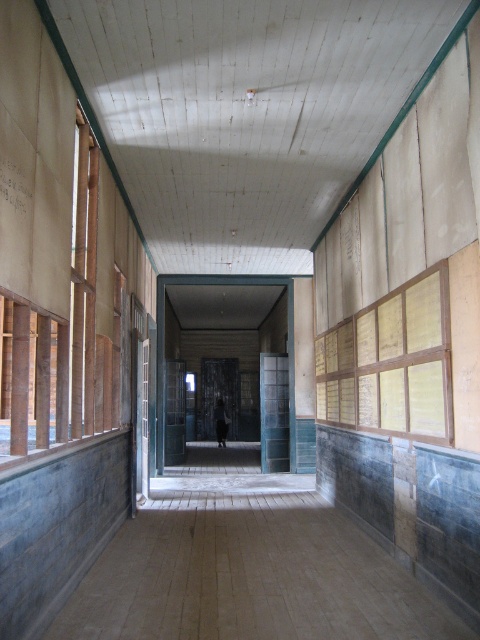
You are standing at the entrance of the corridor and want to place a new poster. You have two options for placement based on the existing items. The wooden paneling at right and the white paper at upper left are already present. Which object is located to the right side of the corridor?

The wooden paneling at right is located to the right side of the corridor, as it is positioned to the right of the white paper at upper left.

You are standing in the corridor and want to move from point A to point B. Point A is at coordinates point (x=20, y=205) and point B is at coordinates point (x=360, y=381). Given the corridor is narrow, will you have to navigate around any obstacles between these two points?

Since point (x=360, y=381) is behind point (x=20, y=205), you can move directly from point A to point B without needing to navigate around obstacles.

You are a painter who needs to cover the wooden paneling at right and the dark gray fabric at center with paint. Which object requires more paint due to its larger surface area?

The dark gray fabric at center requires more paint because it has a greater width than the wooden paneling at right, resulting in a larger surface area.